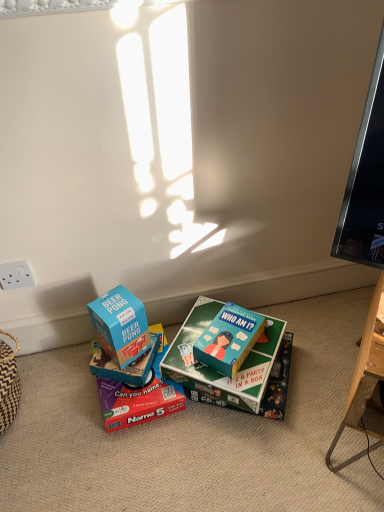
At what (x,y) coordinates should I click in order to perform the action: click on empty space that is ontop of matte cardboard box at center, which is counted as the 3th box, starting from the right (from a real-world perspective). Please return your answer as a coordinate pair (x, y). This screenshot has width=384, height=512. Looking at the image, I should click on (137, 383).